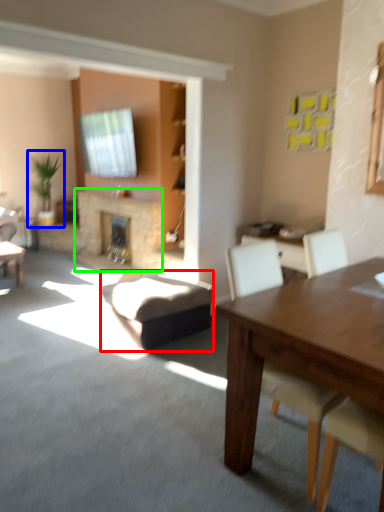
Question: Based on their relative distances, which object is farther from swivel chair (highlighted by a red box)? Choose from houseplant (highlighted by a blue box) and fireplace (highlighted by a green box).

Choices:
 (A) houseplant
 (B) fireplace

Answer: (A)